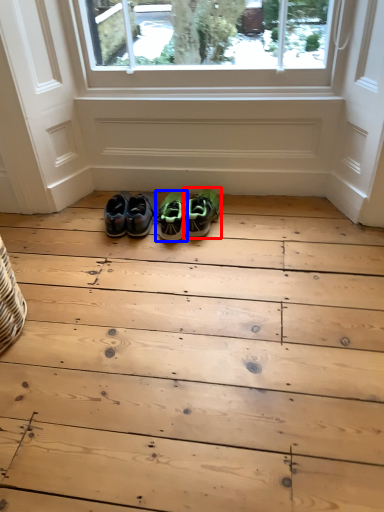
Question: Among these objects, which one is farthest to the camera, footwear (highlighted by a red box) or footwear (highlighted by a blue box)?

Choices:
 (A) footwear
 (B) footwear

Answer: (B)